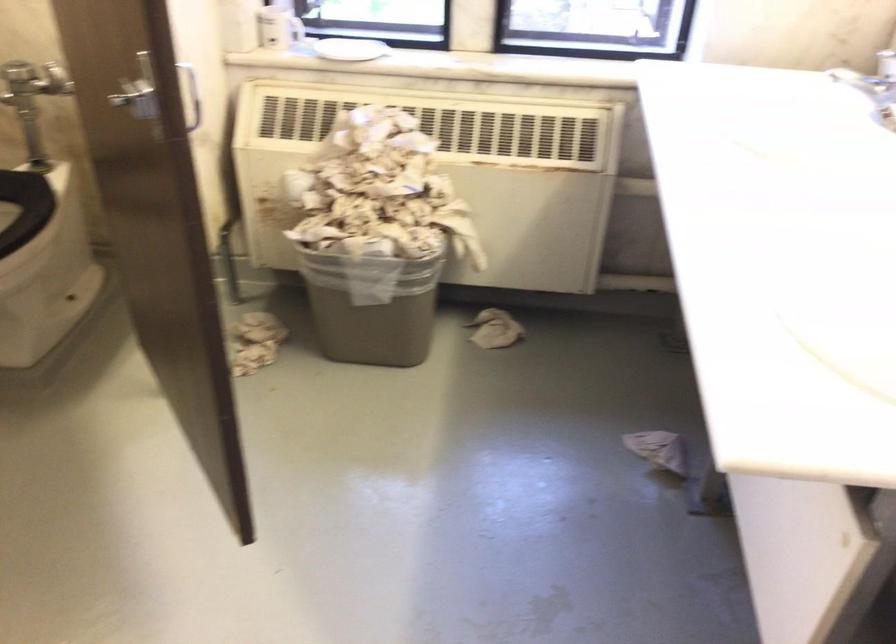
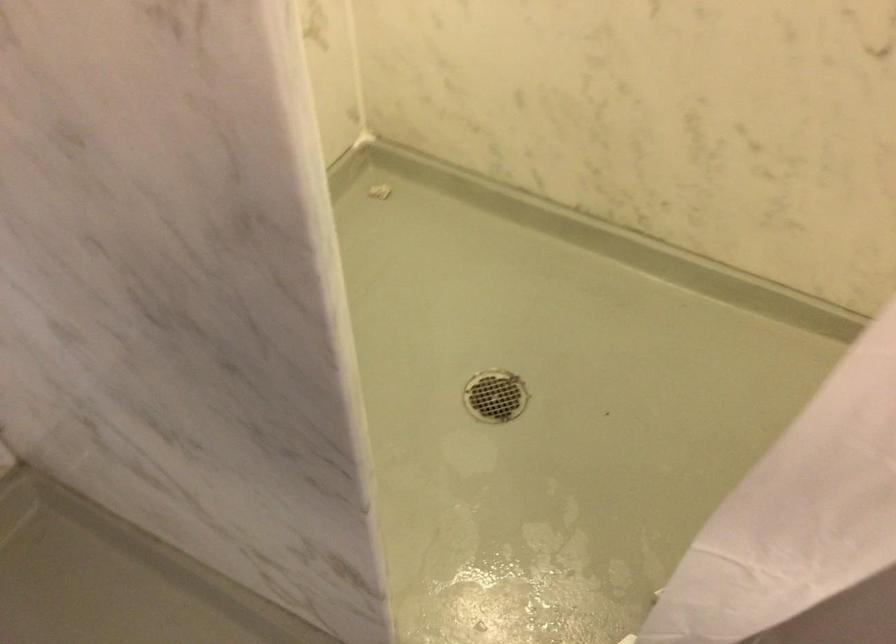
How did the camera likely rotate?

The camera's rotation is toward left-down.